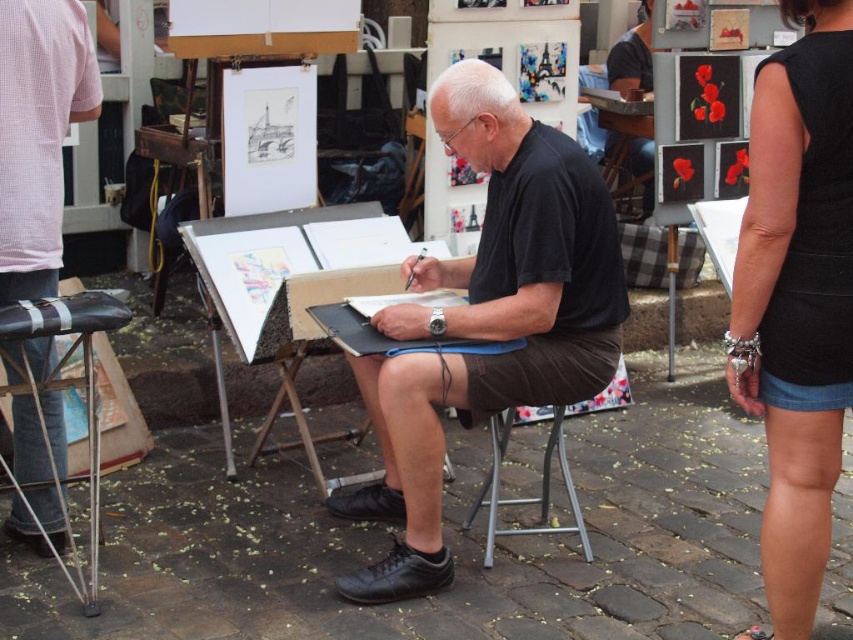
Which is above, black matte shirt at center or black matte dress at center?

black matte dress at center is higher up.

Who is shorter, black matte shirt at center or black matte dress at center?

black matte shirt at center

Find the location of a particular element. black matte shirt at center is located at coordinates (486, 317).

Is matte black shirt at center positioned at the back of wooden easel at center?

No, it is not.

Does matte black shirt at center appear under wooden easel at center?

Actually, matte black shirt at center is above wooden easel at center.

Who is more forward, (56,452) or (343,256)?

Point (56,452)

You are a GUI agent. You are given a task and a screenshot of the screen. Output one action in this format:
    pyautogui.click(x=<x>, y=<y>)
    Task: Click on the matte black shirt at center
    
    Given the screenshot: What is the action you would take?
    pyautogui.click(x=38, y=134)

Is black matte shirt at center thinner than matte black shirt at center?

Incorrect, black matte shirt at center's width is not less than matte black shirt at center's.

Measure the distance between black matte shirt at center and matte black shirt at center.

4.32 feet

What are the coordinates of `black matte shirt at center` in the screenshot? It's located at (486, 317).